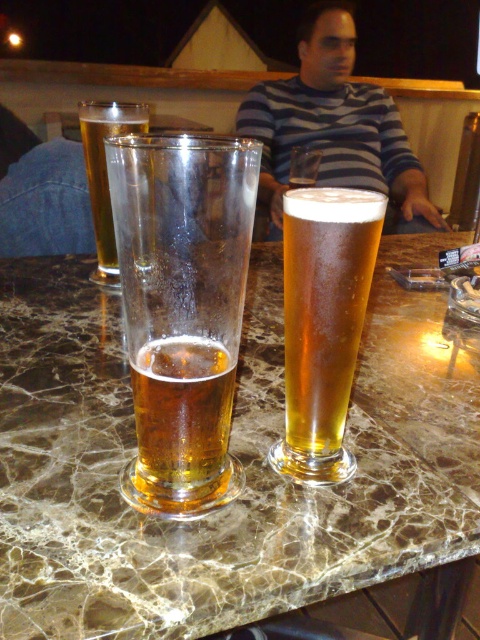
You are a bartender who just received a new marble table at center. You need to place the clear glass beer at center on it. Considering the size of the table, will the beer fit comfortably without touching the edges?

The marble table at center is larger in size than the clear glass beer at center, so placing the beer on it will leave enough space around it to avoid touching the edges.

You are a bartender who needs to serve a customer who prefers a taller glass. Looking at the translucent glass beer at left and the clear glass beer at center, which one should you choose?

The translucent glass beer at left is much taller than the clear glass beer at center, so you should choose the translucent glass beer at left.

You are a bartender who needs to place a new drink order. You observe the translucent glass beer at left and the clear glass beer at center. Which one is directly above the other?

The translucent glass beer at left is positioned under the clear glass beer at center, so the clear glass beer at center is directly above the translucent glass beer at left.